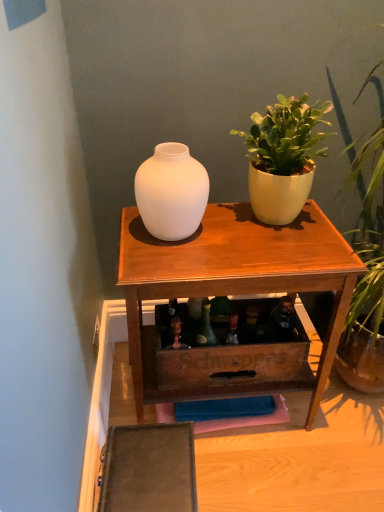
Where is `unoccupied region to the right of matte white vase at center`? unoccupied region to the right of matte white vase at center is located at coordinates (231, 242).